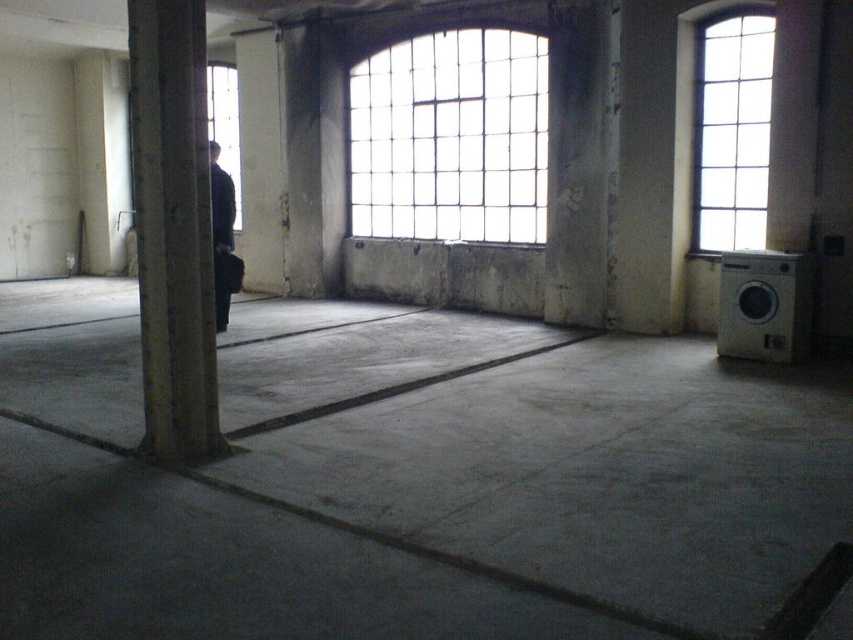
Question: Among these points, which one is farthest from the camera?

Choices:
 (A) (152, 68)
 (B) (697, 86)

Answer: (B)

Question: Does clear glass window at upper right appear over clear glass window at upper center?

Choices:
 (A) yes
 (B) no

Answer: (B)

Question: Is clear glass window at center wider than concrete at left?

Choices:
 (A) yes
 (B) no

Answer: (A)

Question: Can you confirm if concrete at left is smaller than dark blue fabric at left?

Choices:
 (A) yes
 (B) no

Answer: (A)

Question: Which of these objects is positioned farthest from the clear glass window at upper center?

Choices:
 (A) concrete at left
 (B) clear glass window at upper right
 (C) clear glass window at center

Answer: (A)

Question: Which object is farther from the camera taking this photo?

Choices:
 (A) clear glass window at upper right
 (B) clear glass window at center

Answer: (B)